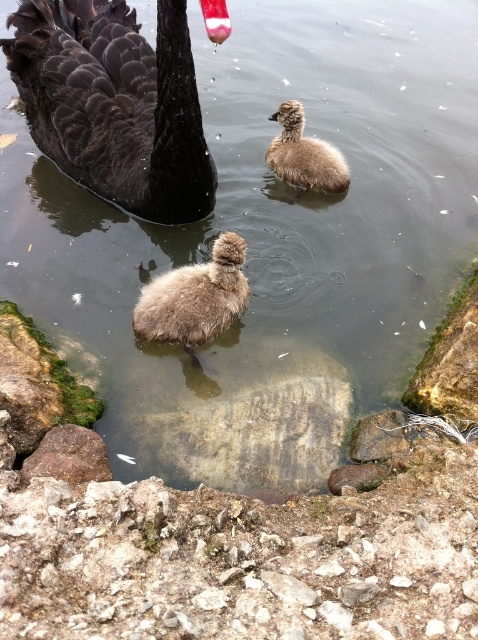
Question: Does shiny black swan at upper left have a larger size compared to fuzzy brown duckling at center?

Choices:
 (A) no
 (B) yes

Answer: (B)

Question: Which object appears farthest from the camera in this image?

Choices:
 (A) fuzzy brown duckling at center
 (B) brown fluffy duckling at center

Answer: (B)

Question: Which object is the farthest from the fuzzy brown duckling at center?

Choices:
 (A) shiny black swan at upper left
 (B) brown fluffy duckling at center

Answer: (B)

Question: Which object appears closest to the camera in this image?

Choices:
 (A) brown fluffy duckling at center
 (B) fuzzy brown duckling at center
 (C) shiny black swan at upper left

Answer: (C)

Question: Can you confirm if shiny black swan at upper left is positioned to the right of brown fluffy duckling at center?

Choices:
 (A) yes
 (B) no

Answer: (B)

Question: Is fuzzy brown duckling at center to the right of brown fluffy duckling at center from the viewer's perspective?

Choices:
 (A) yes
 (B) no

Answer: (B)